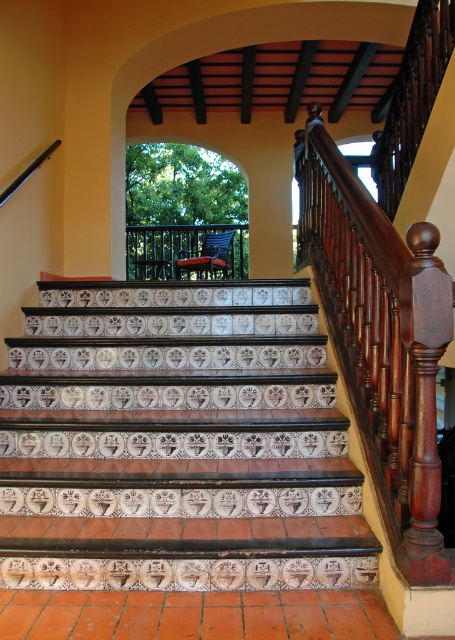
You are a painter standing at the base of the staircase. You need to paint both the mahogany wood railing at upper right and the mahogany wood newel post at right. If your ladder can reach up to 25 inches, will you be able to reach both objects without moving the ladder?

The distance between the mahogany wood railing at upper right and the mahogany wood newel post at right is 26.34 inches. Since your ladder can only reach up to 25 inches, you will not be able to reach both objects without moving the ladder.

You are standing at the bottom of the staircase and want to reach the balcony. Which object, the white glossy tile at center or the mahogany wood railing at upper right, is closer to you?

The white glossy tile at center is closer to you since it is located below the mahogany wood railing at upper right.

You are an interior designer assessing the staircase. You need to know if the white glossy tile at center can be replaced with a wider decorative panel without affecting the mahogany wood railing at upper right. Can the panel be wider than the current tile?

The white glossy tile at center is wider than the mahogany wood railing at upper right. Therefore, a wider panel could be installed as it would not interfere with the existing railing.